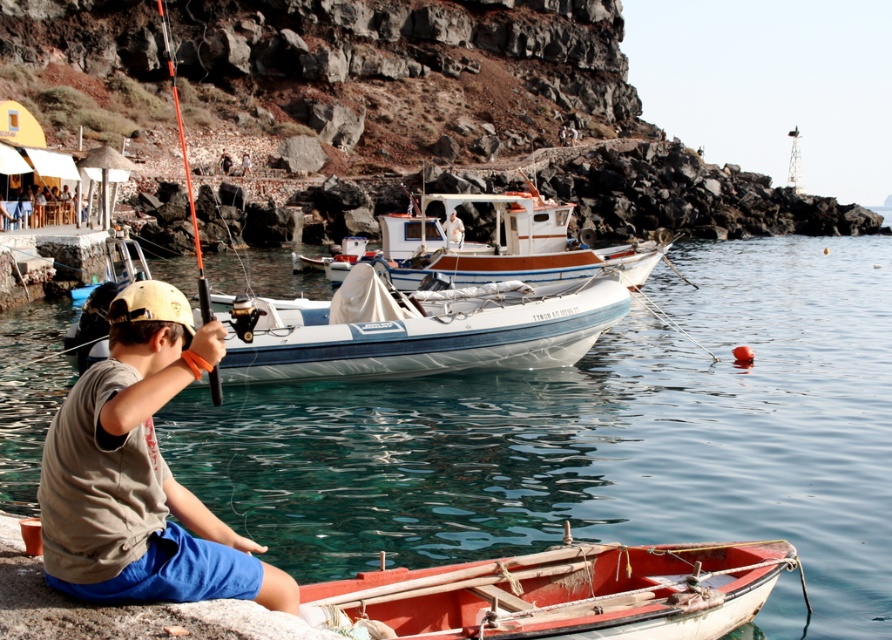
Does rustic wood boat at lower center appear under orange fiberglass fishing pole at left?

Yes, rustic wood boat at lower center is below orange fiberglass fishing pole at left.

Is rustic wood boat at lower center positioned in front of orange fiberglass fishing pole at left?

Yes, rustic wood boat at lower center is closer to the viewer.

The width and height of the screenshot is (892, 640). What do you see at coordinates (572, 592) in the screenshot?
I see `rustic wood boat at lower center` at bounding box center [572, 592].

Identify the location of rustic wood boat at lower center. (572, 592).

Is white rubber boat at center thinner than white wooden boat at center?

Indeed, white rubber boat at center has a lesser width compared to white wooden boat at center.

The height and width of the screenshot is (640, 892). Find the location of `white rubber boat at center`. white rubber boat at center is located at coordinates (417, 330).

Which is in front, point (155, 380) or point (202, 275)?

Point (155, 380)

Does khaki cotton cap at lower left have a greater height compared to orange fiberglass fishing pole at left?

No.

Identify the location of khaki cotton cap at lower left. The height and width of the screenshot is (640, 892). (139, 474).

I want to click on khaki cotton cap at lower left, so click(139, 474).